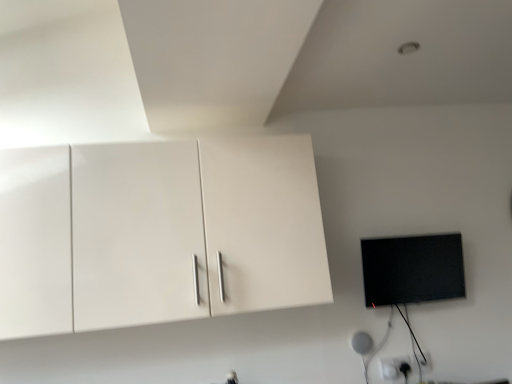
Question: In terms of height, does black glossy flat screen tv at right look taller or shorter compared to white glossy cabinet at upper left?

Choices:
 (A) short
 (B) tall

Answer: (A)

Question: Looking at the image, does black glossy flat screen tv at right seem bigger or smaller compared to white glossy cabinet at upper left?

Choices:
 (A) small
 (B) big

Answer: (A)

Question: Based on their positions, is black glossy flat screen tv at right located to the left or right of white glossy cabinet at upper left?

Choices:
 (A) right
 (B) left

Answer: (A)

Question: From the image's perspective, is white glossy cabinet at upper left located above or below black glossy flat screen tv at right?

Choices:
 (A) above
 (B) below

Answer: (A)

Question: Is point (13, 292) positioned closer to the camera than point (373, 278)?

Choices:
 (A) farther
 (B) closer

Answer: (B)

Question: From a real-world perspective, is white glossy cabinet at upper left physically located above or below black glossy flat screen tv at right?

Choices:
 (A) above
 (B) below

Answer: (A)

Question: Considering the positions of white glossy cabinet at upper left and black glossy flat screen tv at right in the image, is white glossy cabinet at upper left wider or thinner than black glossy flat screen tv at right?

Choices:
 (A) thin
 (B) wide

Answer: (B)